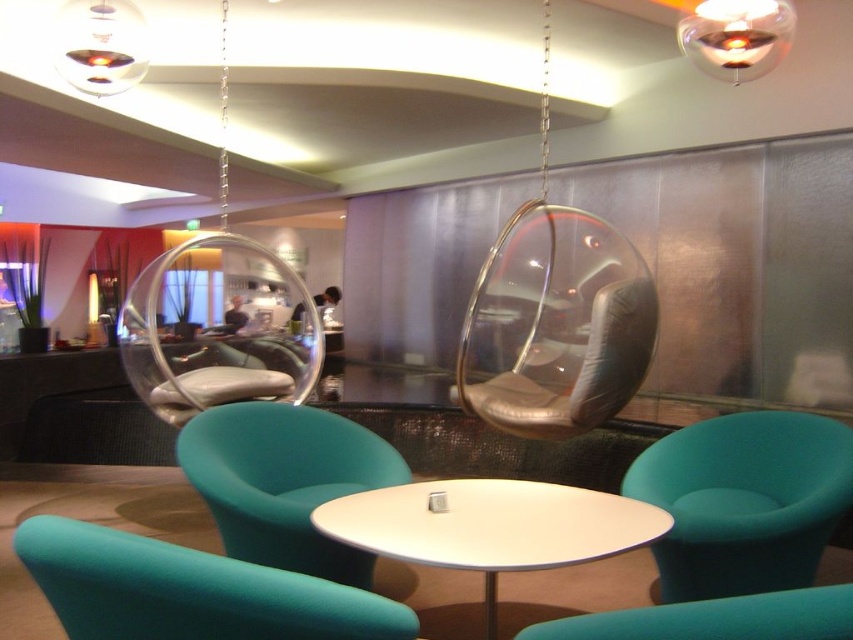
You are a guest in this lounge and want to sit in the teal fabric armchair at lower right. However, there is a teal fabric chair at lower center blocking your path. Can you walk around it to reach your desired seat?

The teal fabric armchair at lower right is further to the viewer than the teal fabric chair at lower center, meaning the teal fabric chair at lower center is closer to you. You can walk around it to reach the teal fabric armchair at lower right since it is behind the closer chair.

What are the coordinates of the teal fabric armchair at lower right in the image?

The teal fabric armchair at lower right is located at coordinates point [744,500].